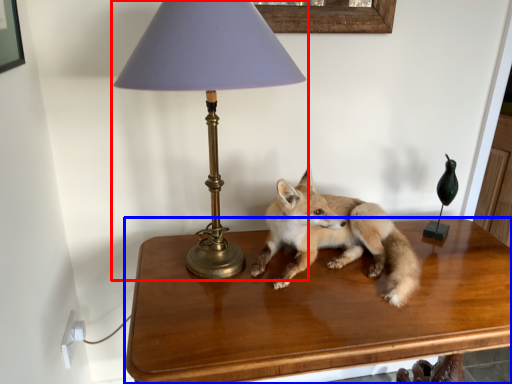
Question: Which object is closer to the camera taking this photo, lamp (highlighted by a red box) or table (highlighted by a blue box)?

Choices:
 (A) lamp
 (B) table

Answer: (A)